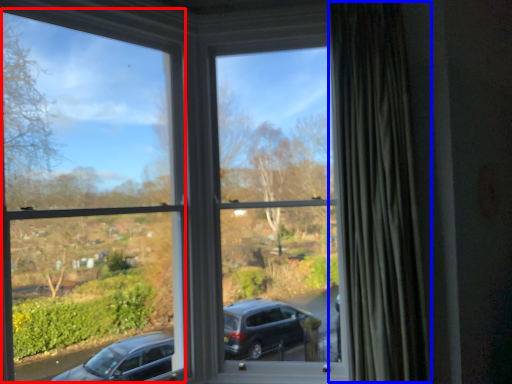
Question: Which of the following is the closest to the observer, window frame (highlighted by a red box) or curtain (highlighted by a blue box)?

Choices:
 (A) window frame
 (B) curtain

Answer: (A)